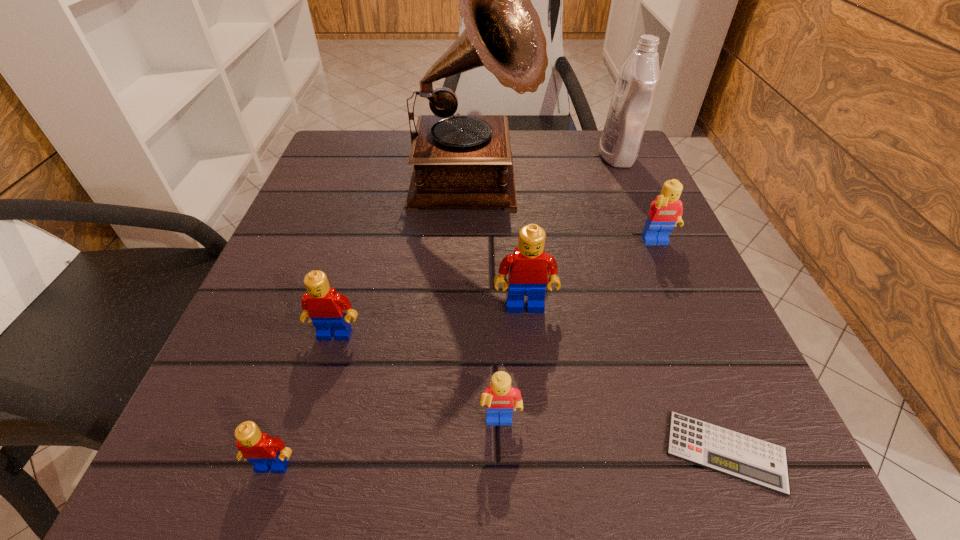
The height and width of the screenshot is (540, 960). What are the coordinates of `object at the near right corner` in the screenshot? It's located at (740, 456).

What are the coordinates of `vacant space at the far edge` in the screenshot? It's located at (541, 141).

Identify the location of vacant area at the left edge of the desktop. The height and width of the screenshot is (540, 960). (317, 209).

Locate an element on the screen. This screenshot has height=540, width=960. vacant space at the right edge of the desktop is located at coordinates (612, 204).

This screenshot has width=960, height=540. In the image, there is a desktop. In order to click on free region at the far left corner in this screenshot , I will do `click(320, 170)`.

The height and width of the screenshot is (540, 960). Identify the location of free spot between the detergent and the bigger yellow Lego. (637, 200).

Find the location of a particular element. free space between the nearer yellow Lego and the second nearest red Lego is located at coordinates (418, 379).

Image resolution: width=960 pixels, height=540 pixels. I want to click on vacant region between the third farthest Lego and the smallest red Lego, so click(x=304, y=400).

The image size is (960, 540). Identify the location of empty space between the shortest object and the second biggest red Lego. (531, 393).

At what (x,y) coordinates should I click in order to perform the action: click on vacant space in between the shortest object and the nearest red Lego. Please return your answer as a coordinate pair (x, y). Looking at the image, I should click on (499, 458).